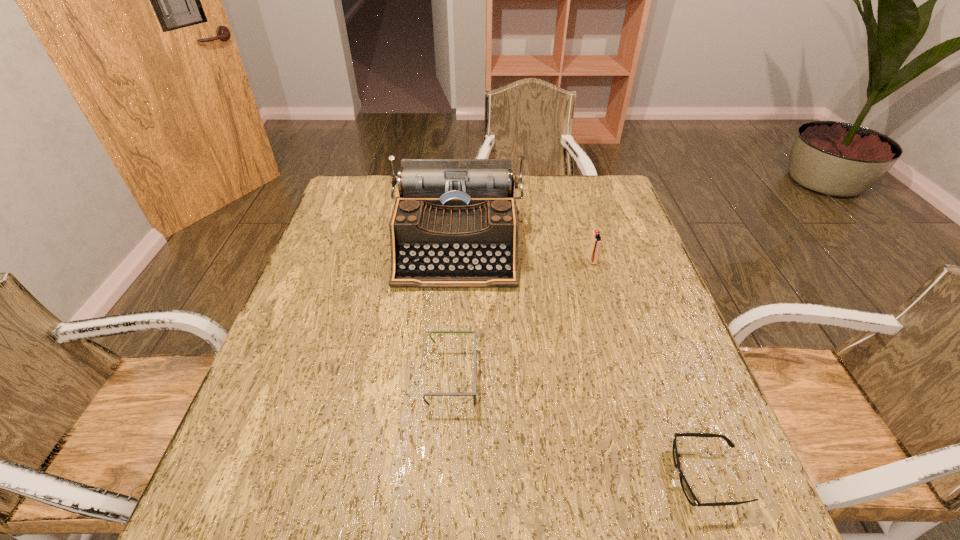
This screenshot has height=540, width=960. I want to click on blank space located on the front-facing side of the sunglasses, so click(538, 477).

This screenshot has width=960, height=540. In order to click on vacant space located 0.320m on the front-facing side of the sunglasses in this screenshot , I will do `click(492, 477)`.

You are a GUI agent. You are given a task and a screenshot of the screen. Output one action in this format:
    pyautogui.click(x=<x>, y=<y>)
    Task: Click on the vacant space located 0.360m on the front-facing side of the sunglasses
    
    Given the screenshot: What is the action you would take?
    pyautogui.click(x=469, y=477)

The image size is (960, 540). Identify the location of object situated at the far edge. (455, 225).

In order to click on object present at the near edge in this screenshot , I will do `click(686, 488)`.

You are a GUI agent. You are given a task and a screenshot of the screen. Output one action in this format:
    pyautogui.click(x=<x>, y=<y>)
    Task: Click on the igniter located at the right edge
    The height and width of the screenshot is (540, 960).
    Given the screenshot: What is the action you would take?
    pyautogui.click(x=596, y=240)

In order to click on sunglasses that is positioned at the right edge in this screenshot , I will do `click(686, 488)`.

At what (x,y) coordinates should I click in order to perform the action: click on object present at the near right corner. Please return your answer as a coordinate pair (x, y). This screenshot has width=960, height=540. Looking at the image, I should click on (686, 488).

At what (x,y) coordinates should I click in order to perform the action: click on free space at the far edge of the desktop. Please return your answer as a coordinate pair (x, y). This screenshot has width=960, height=540. Looking at the image, I should click on click(x=390, y=198).

Where is `vacant space at the near edge of the desktop`? vacant space at the near edge of the desktop is located at coordinates (489, 525).